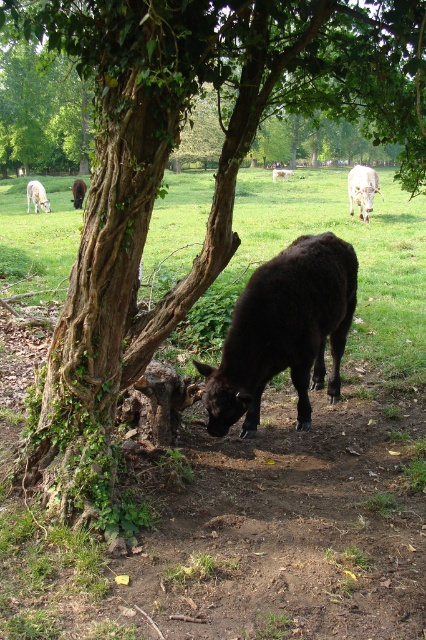
You are a farmer who needs to separate the black woolly sheep at lower center from the brown furry cow at center. Given that your fence can only cover a 20 meter distance, can you build a fence between them to keep them apart?

The distance between the black woolly sheep at lower center and the brown furry cow at center is 21.78 meters. Since the fence can only cover 20 meters, it is insufficient to span the gap between them. Therefore, you cannot build a fence between them to keep them apart.

You are standing in the middle of the scene and want to walk to both points. Which point should you reach first, point (296, 385) or point (279, 170)?

You should reach point (296, 385) first because it is closer to the viewer than point (279, 170).

You are a photographer aiming to capture the black glossy cow at center and the green leafy grass at center in a single frame. Based on their positions, which object should you adjust your camera to focus on first to ensure both are in the shot?

The green leafy grass at center is to the right of the black glossy cow at center. To include both in the frame, focus on the black glossy cow at center first, then adjust the camera to include the grass to its right.